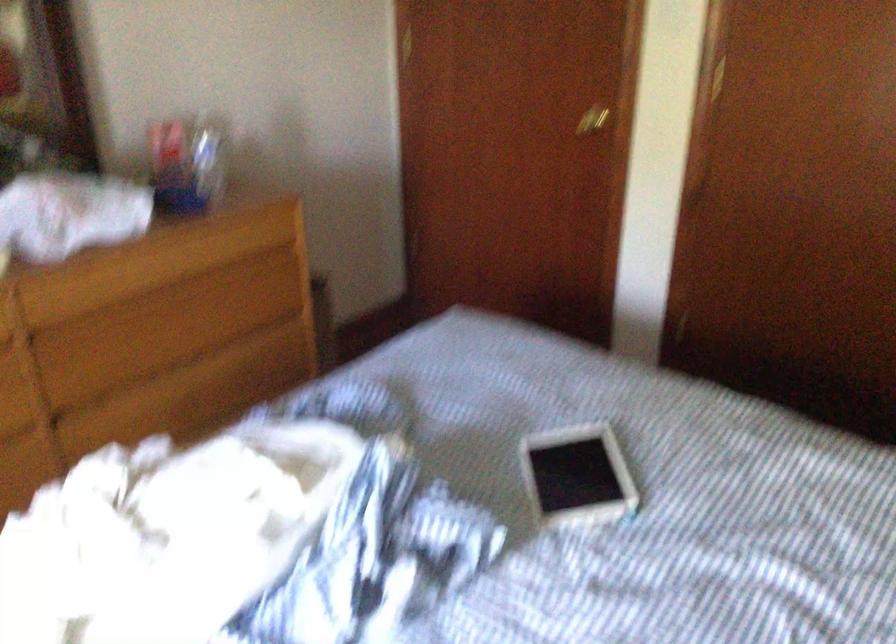
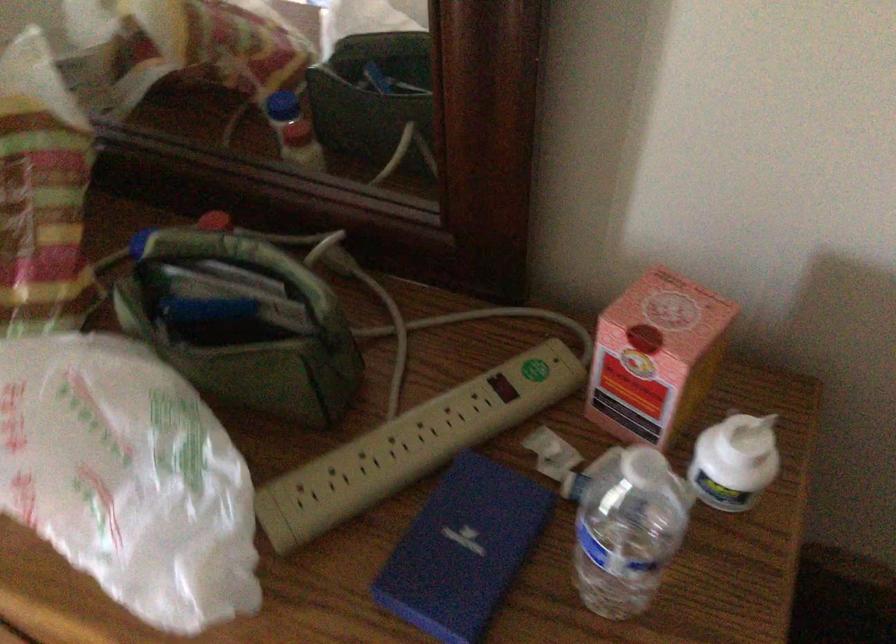
Where in the second image is the point corresponding to [174,136] from the first image?

(656, 357)